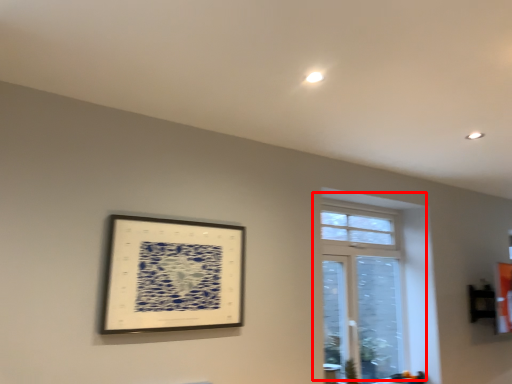
Question: From the image's perspective, where is window (annotated by the red box) located relative to picture frame?

Choices:
 (A) below
 (B) above

Answer: (A)